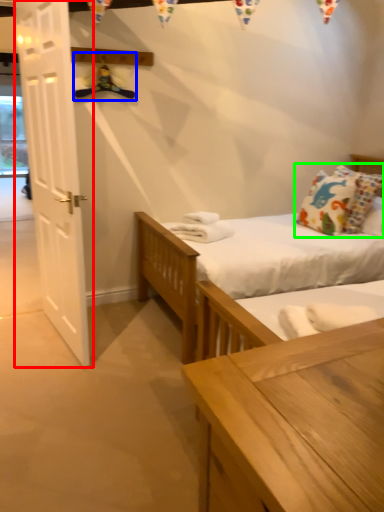
Question: Estimate the real-world distances between objects in this image. Which object is farther from door (highlighted by a red box), hanger (highlighted by a blue box) or pillow (highlighted by a green box)?

Choices:
 (A) hanger
 (B) pillow

Answer: (B)